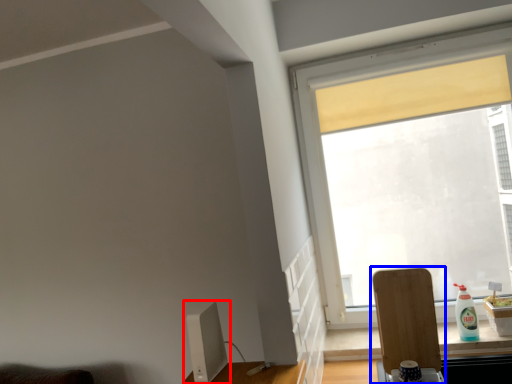
Question: Which point is closer to the camera, computer monitor (highlighted by a red box) or swivel chair (highlighted by a blue box)?

Choices:
 (A) computer monitor
 (B) swivel chair

Answer: (A)